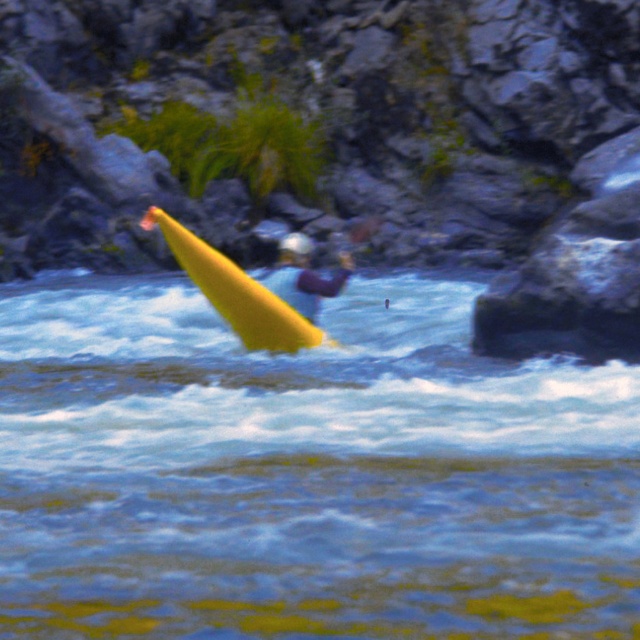
You are a photographer trying to capture the kayaker in the image. Since you want to focus on the shiny yellow canoe at center and the smooth purple helmet at center, which object should you zoom in on to ensure both are clearly visible in the frame?

You should zoom in on the shiny yellow canoe at center because it is larger than the smooth purple helmet at center, allowing both objects to be captured clearly without cropping either out.

You are a photographer trying to capture the kayaker in the scene. You want to frame your shot so that the yellow rubber boat at upper left and the smooth purple helmet at center are both visible. Based on their positions, which object should you place on the left side of your camera frame?

The yellow rubber boat at upper left should be placed on the left side of your camera frame since it is positioned to the left of the smooth purple helmet at center.

You are a photographer trying to capture the yellow kayak in the center of the image. The scene has a point marked at coordinates (236, 291). Where should you aim your camera to ensure the yellow kayak is centered in your shot?

The point at coordinates (236, 291) marks the shiny yellow canoe at center, so you should aim your camera at that point to center the yellow kayak in your shot.